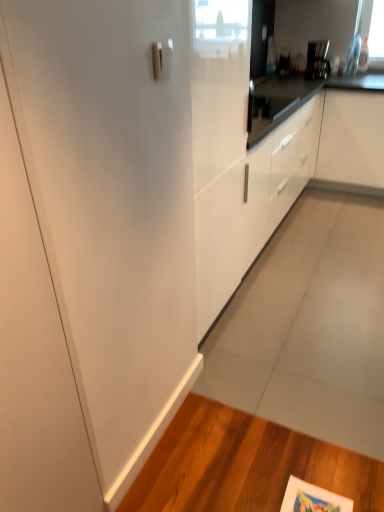
Question: Is white matte cabinet at center, placed as the 1th cabinetry when sorted from right to left, further to camera compared to satin black coffee maker at upper right?

Choices:
 (A) no
 (B) yes

Answer: (A)

Question: Is white matte cabinet at center, which is the second cabinetry in left-to-right order, beside satin black coffee maker at upper right?

Choices:
 (A) yes
 (B) no

Answer: (B)

Question: From a real-world perspective, is white matte cabinet at center, which is the second cabinetry in left-to-right order, over satin black coffee maker at upper right?

Choices:
 (A) yes
 (B) no

Answer: (B)

Question: Is white matte cabinet at center, placed as the 1th cabinetry when sorted from right to left, at the right side of satin black coffee maker at upper right?

Choices:
 (A) no
 (B) yes

Answer: (B)

Question: Can you confirm if white matte cabinet at center, placed as the 1th cabinetry when sorted from right to left, is wider than satin black coffee maker at upper right?

Choices:
 (A) no
 (B) yes

Answer: (B)

Question: Considering the relative sizes of white matte cabinet at center, which is the second cabinetry in left-to-right order, and satin black coffee maker at upper right in the image provided, is white matte cabinet at center, which is the second cabinetry in left-to-right order, smaller than satin black coffee maker at upper right?

Choices:
 (A) no
 (B) yes

Answer: (A)

Question: Does white matte cabinet at center, which is the second cabinetry in left-to-right order, have a larger size compared to white glossy cabinet at center, acting as the second cabinetry starting from the right?

Choices:
 (A) yes
 (B) no

Answer: (B)

Question: Is white matte cabinet at center, which is the second cabinetry in left-to-right order, behind white glossy cabinet at center, acting as the second cabinetry starting from the right?

Choices:
 (A) yes
 (B) no

Answer: (A)

Question: Is white matte cabinet at center, which is the second cabinetry in left-to-right order, oriented away from white glossy cabinet at center, which is the first cabinetry from left to right?

Choices:
 (A) yes
 (B) no

Answer: (A)

Question: From a real-world perspective, is white matte cabinet at center, which is the second cabinetry in left-to-right order, located higher than white glossy cabinet at center, which is the first cabinetry from left to right?

Choices:
 (A) no
 (B) yes

Answer: (A)

Question: From the image's perspective, is white matte cabinet at center, which is the second cabinetry in left-to-right order, over white glossy cabinet at center, which is the first cabinetry from left to right?

Choices:
 (A) yes
 (B) no

Answer: (A)

Question: Considering the relative sizes of white matte cabinet at center, which is the second cabinetry in left-to-right order, and white glossy cabinet at center, acting as the second cabinetry starting from the right, in the image provided, is white matte cabinet at center, which is the second cabinetry in left-to-right order, taller than white glossy cabinet at center, acting as the second cabinetry starting from the right,?

Choices:
 (A) yes
 (B) no

Answer: (A)

Question: From the image's perspective, is white matte cabinet at center, which is the second cabinetry in left-to-right order, below satin nickel door handle at upper center?

Choices:
 (A) yes
 (B) no

Answer: (B)